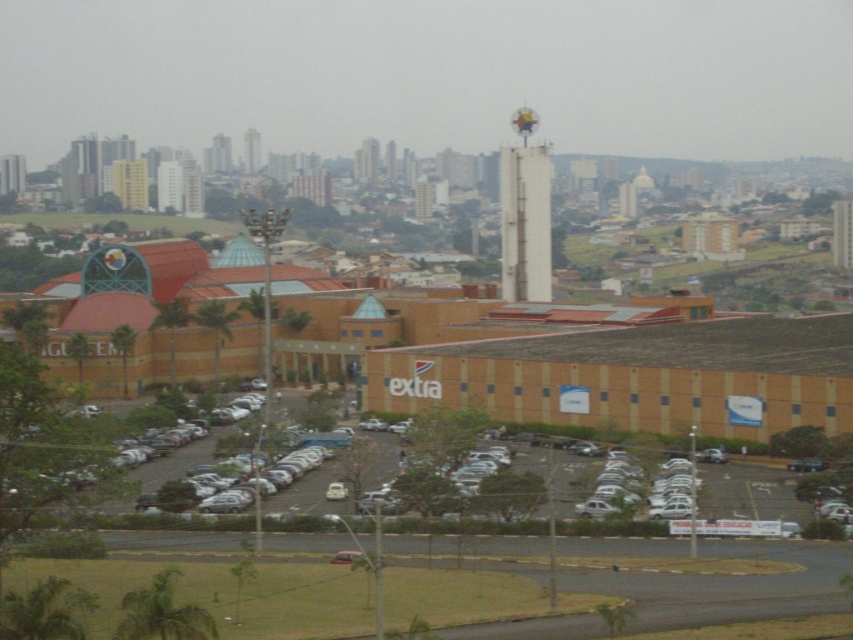
Question: Can you confirm if white concrete bell tower at center is wider than white concrete tower at upper center?

Choices:
 (A) yes
 (B) no

Answer: (A)

Question: Which point is closer to the camera taking this photo?

Choices:
 (A) (252, 172)
 (B) (506, 179)

Answer: (B)

Question: Which point is closer to the camera?

Choices:
 (A) white concrete bell tower at center
 (B) white concrete tower at upper center

Answer: (A)

Question: Which point is farther to the camera?

Choices:
 (A) (537, 244)
 (B) (242, 145)

Answer: (B)

Question: Is white concrete bell tower at center closer to the viewer compared to white concrete tower at upper center?

Choices:
 (A) yes
 (B) no

Answer: (A)

Question: Where is white concrete bell tower at center located in relation to white concrete tower at upper center in the image?

Choices:
 (A) below
 (B) above

Answer: (A)